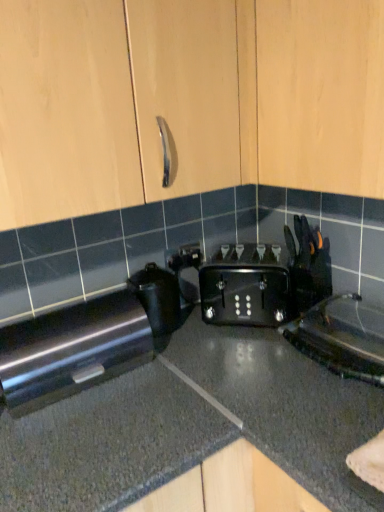
Locate an element on the screen. This screenshot has height=512, width=384. free spot to the left of black plastic kettle at lower right, the 2th appliance in the left-to-right sequence is located at coordinates (256, 375).